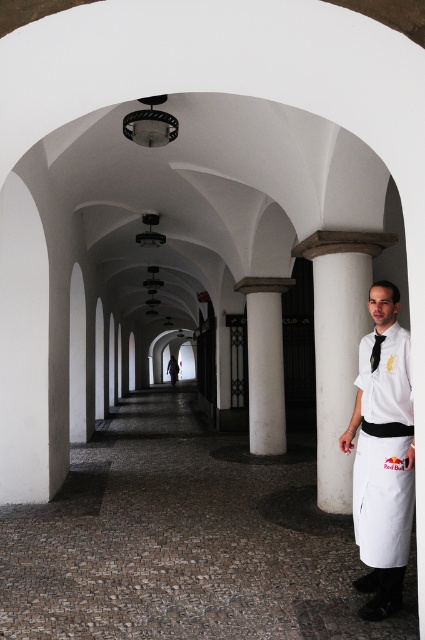
You are a photographer setting up a shoot in the corridor. You have two props to place on a column at the right side of the corridor. The props are the white matte uniform at right and the black silk tie at right. Which prop should you choose if you want the one that is taller to stand out more against the column?

You should choose the white matte uniform at right because it has a greater height compared to the black silk tie at right, making it more noticeable against the column.

You are standing in the corridor and notice a point marked at coordinates (x=337, y=344). Based on the scene description, what object is located at this point?

The point at coordinates (x=337, y=344) corresponds to the white smooth column at right.

You are standing at the entrance of the corridor and see the white matte uniform at right. If you walk straight ahead, will you encounter the uniform before reaching the end of the corridor?

The white matte uniform at right is located at point 0.714 on the x axis and 0.901 on the y axis. Since the corridor is long and arched with evenly spaced columns, the uniform is positioned near the end of the corridor. Therefore, walking straight ahead, you would encounter the uniform before reaching the end of the corridor.